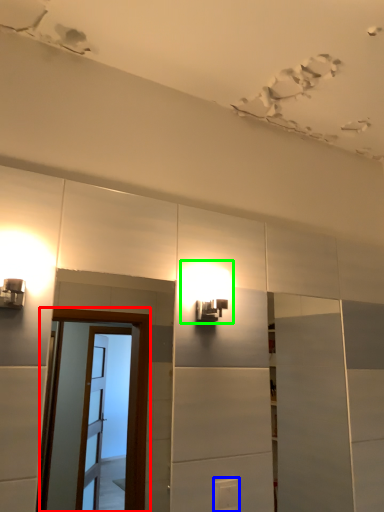
Question: Estimate the real-world distances between objects in this image. Which object is closer to screen door (highlighted by a red box), light switch (highlighted by a blue box) or light fixture (highlighted by a green box)?

Choices:
 (A) light switch
 (B) light fixture

Answer: (B)